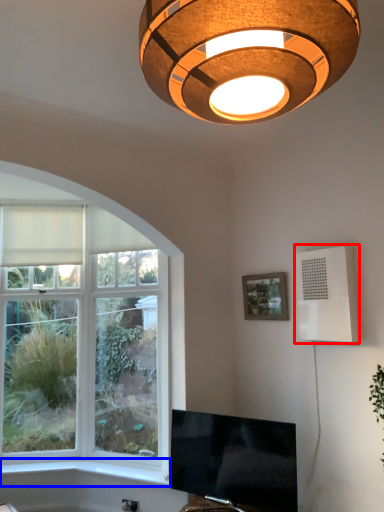
Question: Which object is closer to the camera taking this photo, air conditioning (highlighted by a red box) or window sill (highlighted by a blue box)?

Choices:
 (A) air conditioning
 (B) window sill

Answer: (A)